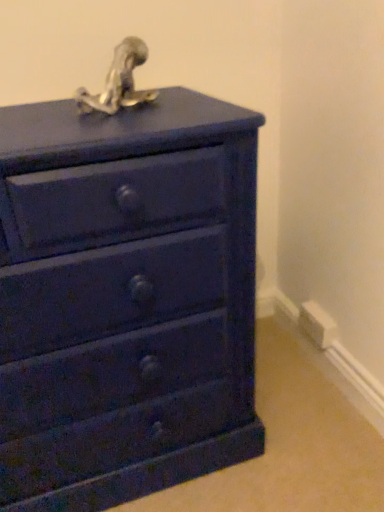
Locate an element on the screen. vacant space that is to the left of metallic silver sculpture at top is located at coordinates (36, 117).